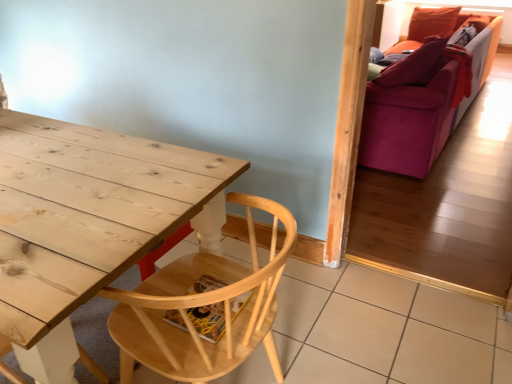
Identify the location of vacant area that lies to the right of natural wood chair at lower left. (356, 344).